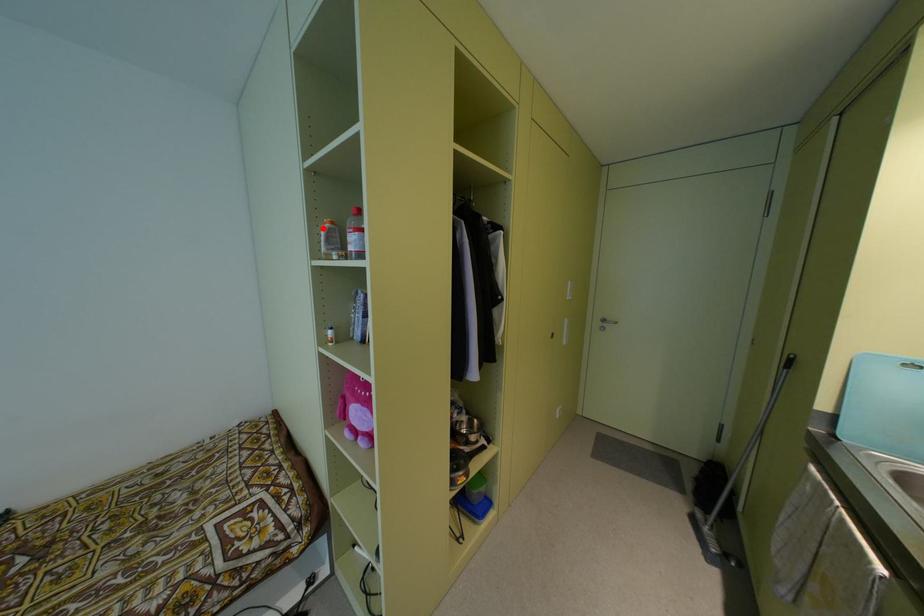
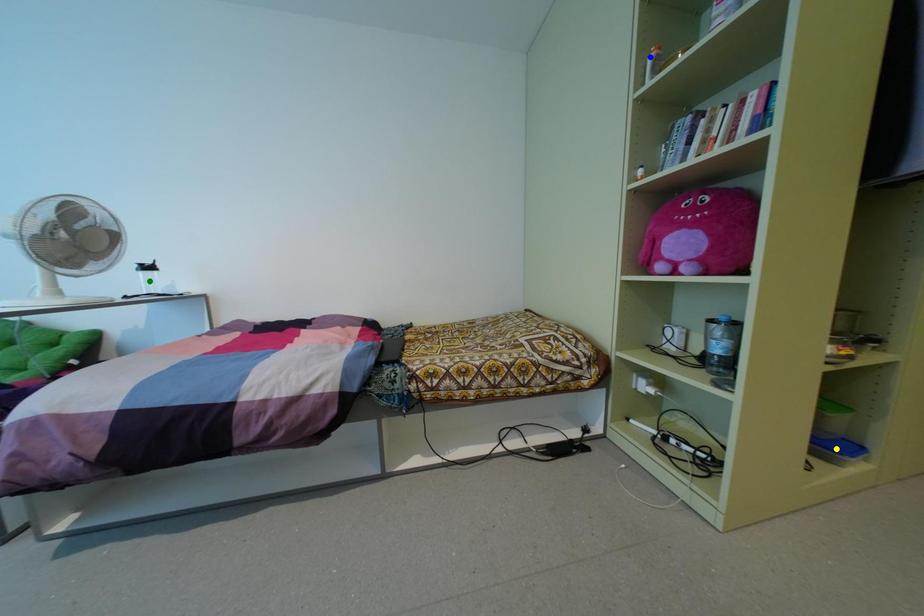
Question: I am providing you with two images of the same scene from different viewpoints. A red point is marked on the first image. You are given multiple points on the second image. Which spot in image 2 lines up with the point in image 1?

Choices:
 (A) blue point
 (B) yellow point
 (C) green point

Answer: (A)